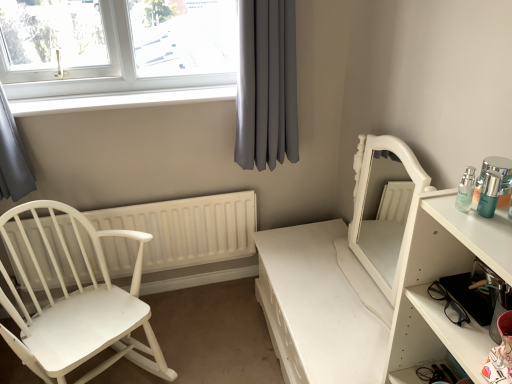
Question: From a real-world perspective, is gray fabric curtain at upper center positioned over white glossy mirror at right based on gravity?

Choices:
 (A) no
 (B) yes

Answer: (B)

Question: Does gray fabric curtain at upper center have a larger size compared to white glossy mirror at right?

Choices:
 (A) yes
 (B) no

Answer: (B)

Question: Considering the relative positions of gray fabric curtain at upper center and white glossy mirror at right in the image provided, is gray fabric curtain at upper center behind white glossy mirror at right?

Choices:
 (A) no
 (B) yes

Answer: (B)

Question: Is gray fabric curtain at upper center completely or partially outside of white glossy mirror at right?

Choices:
 (A) yes
 (B) no

Answer: (A)

Question: Could you tell me if gray fabric curtain at upper center is turned towards white glossy mirror at right?

Choices:
 (A) no
 (B) yes

Answer: (B)

Question: Is white glossy mirror at right surrounded by gray fabric curtain at upper center?

Choices:
 (A) yes
 (B) no

Answer: (B)

Question: Is matte glass bottles at right facing towards white plastic window at upper left?

Choices:
 (A) no
 (B) yes

Answer: (A)

Question: From the image's perspective, is matte glass bottles at right beneath white plastic window at upper left?

Choices:
 (A) yes
 (B) no

Answer: (A)

Question: From a real-world perspective, is matte glass bottles at right physically above white plastic window at upper left?

Choices:
 (A) no
 (B) yes

Answer: (A)

Question: Does matte glass bottles at right have a smaller size compared to white plastic window at upper left?

Choices:
 (A) yes
 (B) no

Answer: (A)

Question: Is matte glass bottles at right next to white plastic window at upper left?

Choices:
 (A) yes
 (B) no

Answer: (B)

Question: Is matte glass bottles at right positioned with its back to white plastic window at upper left?

Choices:
 (A) yes
 (B) no

Answer: (B)

Question: Considering the relative sizes of white glossy mirror at right and gray fabric curtain at upper center in the image provided, is white glossy mirror at right thinner than gray fabric curtain at upper center?

Choices:
 (A) yes
 (B) no

Answer: (B)